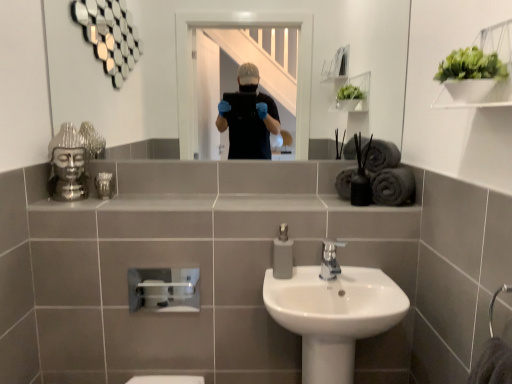
Question: Visually, is white glossy sink at center positioned to the left or to the right of matte gray soap dispenser at center?

Choices:
 (A) right
 (B) left

Answer: (A)

Question: Considering the positions of white glossy sink at center and matte gray soap dispenser at center in the image, is white glossy sink at center taller or shorter than matte gray soap dispenser at center?

Choices:
 (A) short
 (B) tall

Answer: (B)

Question: Considering the real-world distances, which object is farthest from the metallic glass at upper left?

Choices:
 (A) white matte plant at upper right
 (B) white glossy sink at center
 (C) matte gray soap dispenser at center
 (D) dark gray matte bath towel at right, the second bath towel when ordered from top to bottom
 (E) satin nickel faucet at center

Answer: (A)

Question: Based on their relative distances, which object is farther from the white matte plant at upper right?

Choices:
 (A) dark gray matte bath towel at right, the second bath towel when ordered from top to bottom
 (B) white glossy sink at center
 (C) satin nickel faucet at center
 (D) matte gray soap dispenser at center
 (E) metallic glass at upper left

Answer: (E)